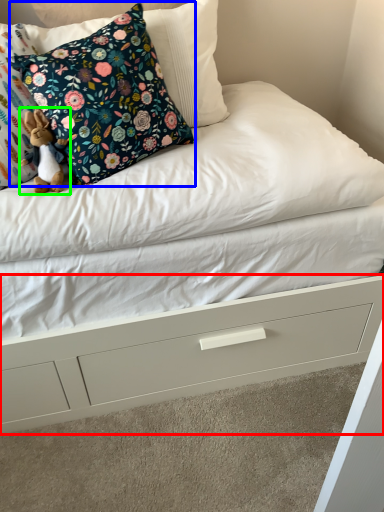
Question: Estimate the real-world distances between objects in this image. Which object is closer to drawer (highlighted by a red box), pillow (highlighted by a blue box) or toy (highlighted by a green box)?

Choices:
 (A) pillow
 (B) toy

Answer: (A)